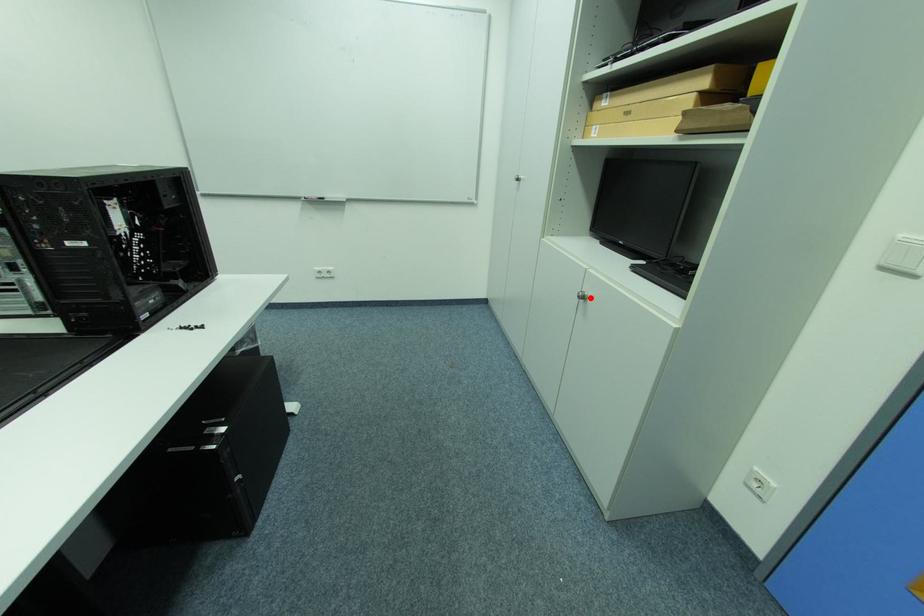
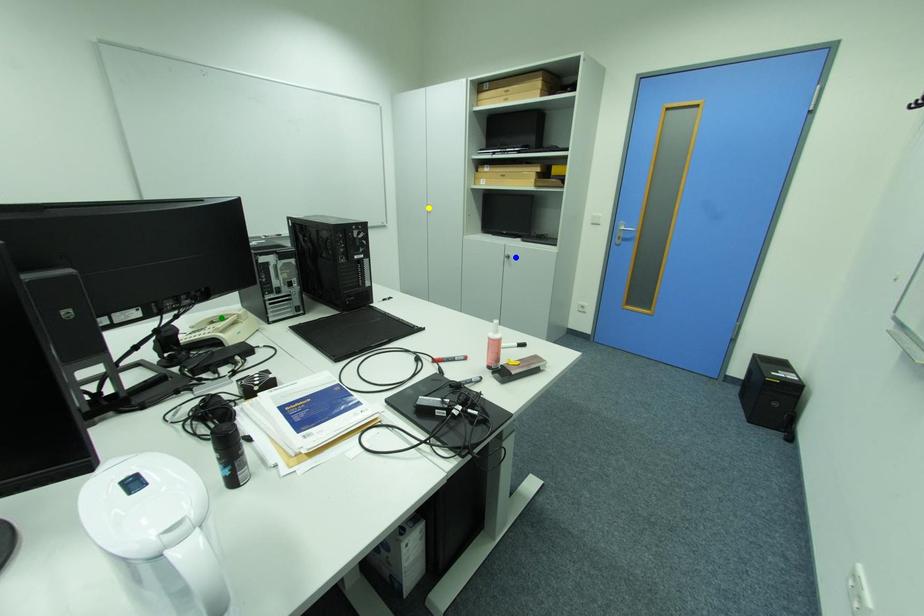
Question: I am providing you with two images of the same scene from different viewpoints. A red point is marked on the first image. You are given multiple points on the second image. Which mark in image 2 goes with the point in image 1?

Choices:
 (A) blue point
 (B) yellow point
 (C) green point

Answer: (A)